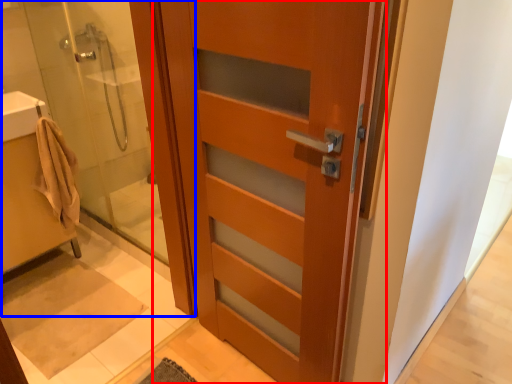
Question: Which object appears closest to the camera in this image, door (highlighted by a red box) or shower door (highlighted by a blue box)?

Choices:
 (A) door
 (B) shower door

Answer: (A)